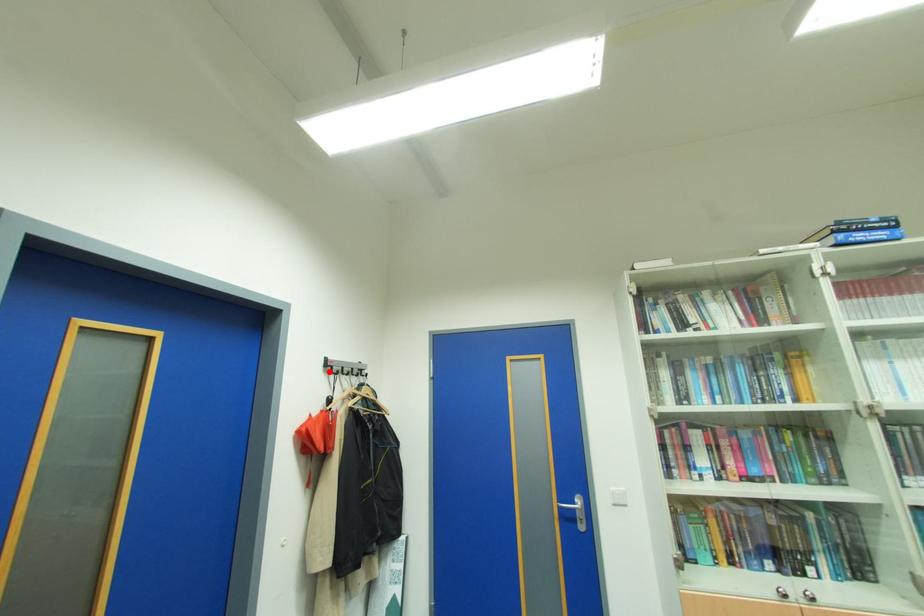
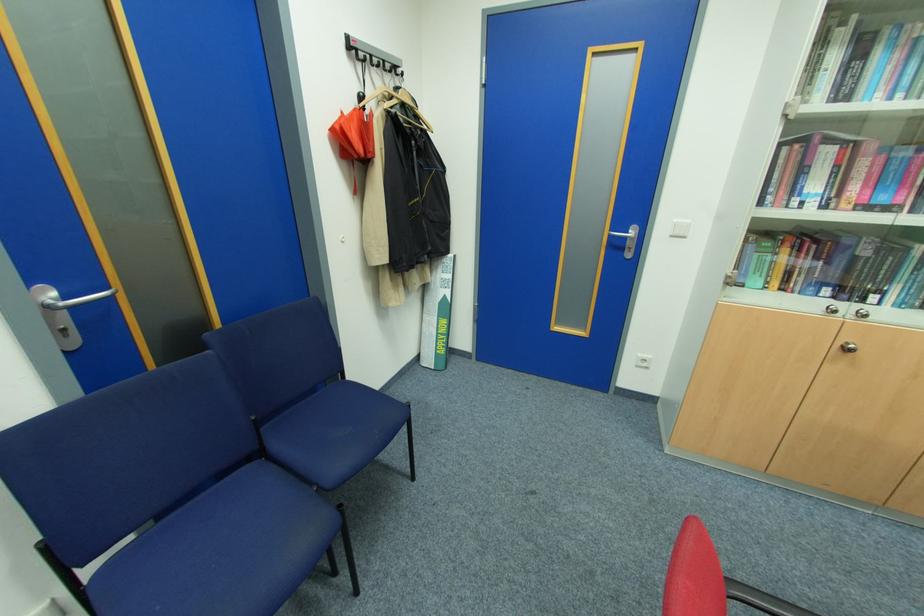
Where in the second image is the point corresponding to the highlighted location from the first image?

(353, 55)